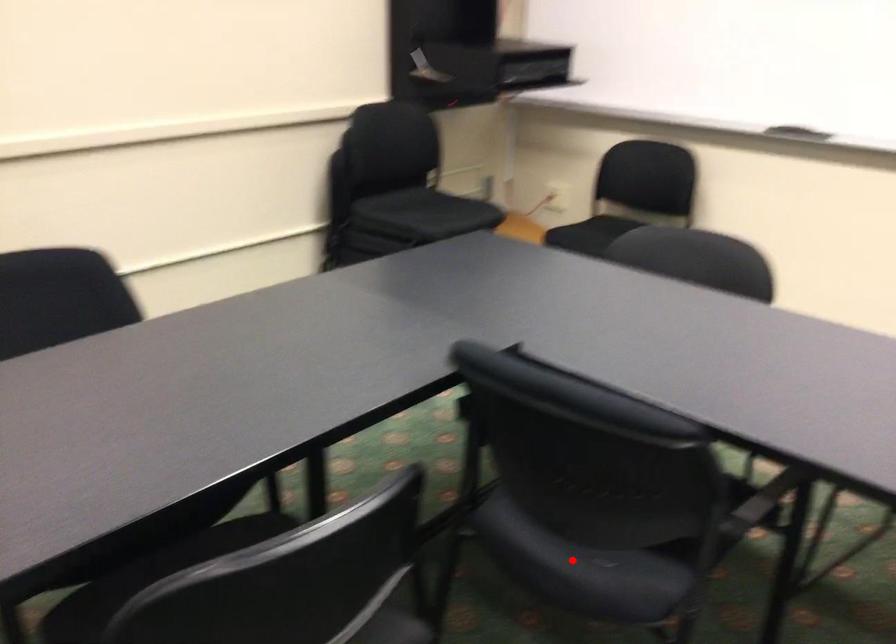
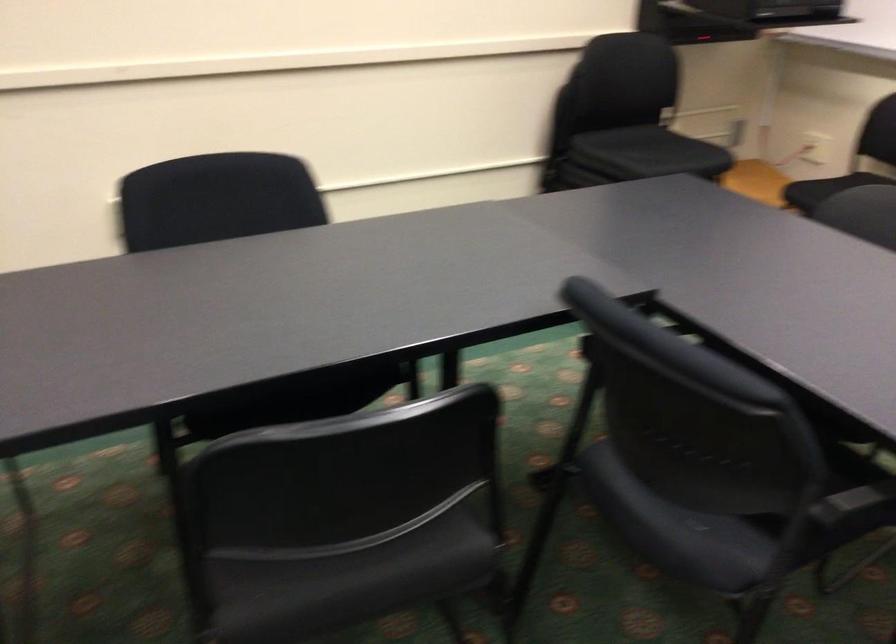
The point at the highlighted location is marked in the first image. Where is the corresponding point in the second image?

(666, 515)